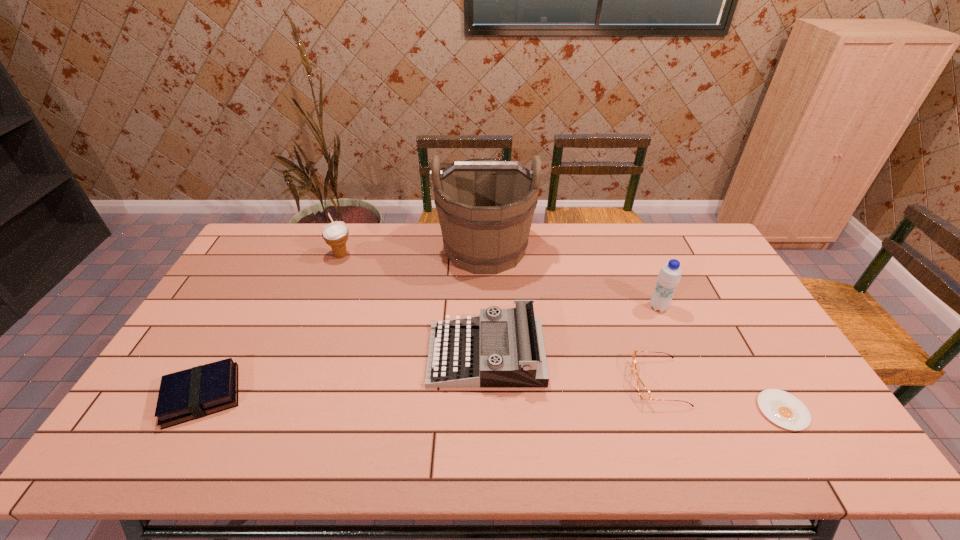
I want to click on bucket that is at the far edge, so click(x=485, y=207).

The height and width of the screenshot is (540, 960). In order to click on icecream that is at the far edge in this screenshot , I will do `click(335, 234)`.

The image size is (960, 540). I want to click on book that is at the near edge, so click(x=190, y=394).

I want to click on egg yolk located in the near edge section of the desktop, so click(782, 408).

You are a GUI agent. You are given a task and a screenshot of the screen. Output one action in this format:
    pyautogui.click(x=<x>, y=<y>)
    Task: Click on the object that is at the left edge
    The height and width of the screenshot is (540, 960).
    Given the screenshot: What is the action you would take?
    pyautogui.click(x=190, y=394)

Where is `object that is at the right edge`? Image resolution: width=960 pixels, height=540 pixels. object that is at the right edge is located at coordinates (782, 408).

You are a GUI agent. You are given a task and a screenshot of the screen. Output one action in this format:
    pyautogui.click(x=<x>, y=<y>)
    Task: Click on the object at the near left corner
    
    Given the screenshot: What is the action you would take?
    pyautogui.click(x=190, y=394)

This screenshot has width=960, height=540. Find the location of `object that is at the near right corner`. object that is at the near right corner is located at coordinates (782, 408).

Find the location of a particular element. vacant space at the far edge of the desktop is located at coordinates (306, 238).

Image resolution: width=960 pixels, height=540 pixels. In the image, there is a desktop. Identify the location of vacant region at the near edge. (x=747, y=437).